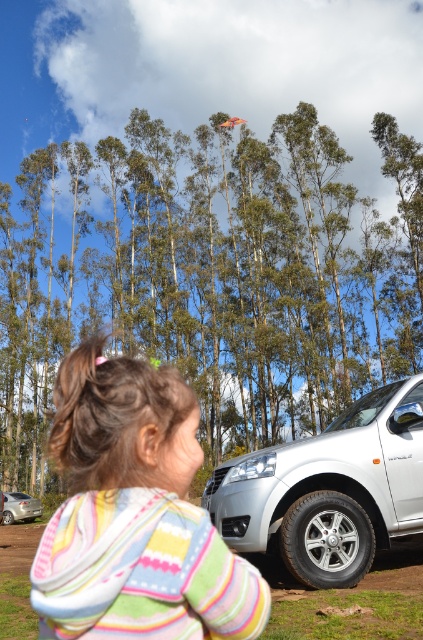
Question: Which point is closer to the camera?

Choices:
 (A) striped hoodie at lower left
 (B) silver metallic sedan at lower left
 (C) multicolored fabric kite at upper center

Answer: (A)

Question: Where is green leafy trees at center located in relation to multicolored fabric kite at upper center in the image?

Choices:
 (A) right
 (B) left

Answer: (B)

Question: Does green leafy trees at center have a smaller size compared to silver metallic sedan at lower left?

Choices:
 (A) no
 (B) yes

Answer: (A)

Question: Is silver metallic suv at lower right to the right of multicolored fabric kite at upper center from the viewer's perspective?

Choices:
 (A) yes
 (B) no

Answer: (A)

Question: Considering the real-world distances, which object is closest to the silver metallic suv at lower right?

Choices:
 (A) striped hoodie at lower left
 (B) silver metallic sedan at lower left
 (C) multicolored fabric kite at upper center

Answer: (A)

Question: Which point is closer to the camera?

Choices:
 (A) (247, 221)
 (B) (167, 458)
 (C) (32, 518)

Answer: (B)